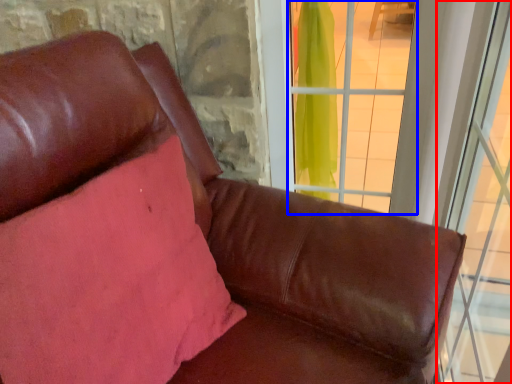
Question: Which object appears farthest to the camera in this image, window (highlighted by a red box) or window (highlighted by a blue box)?

Choices:
 (A) window
 (B) window

Answer: (B)